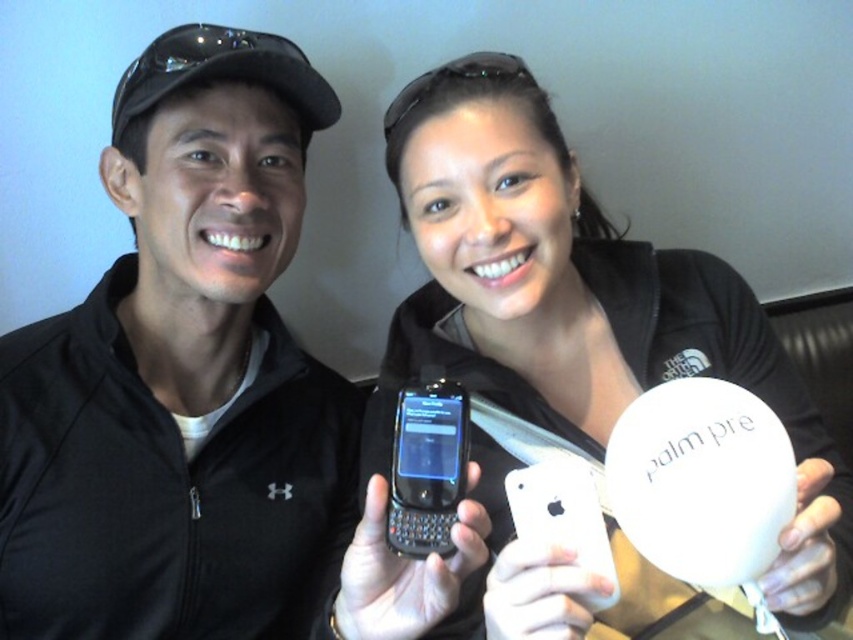
Is white matte palm pre case at center smaller than black plastic smartphone at center?

No, white matte palm pre case at center is not smaller than black plastic smartphone at center.

Which is below, white matte palm pre case at center or black plastic smartphone at center?

black plastic smartphone at center

Which is behind, point (567, 321) or point (398, 483)?

The point (567, 321) is more distant.

This screenshot has height=640, width=853. I want to click on white matte palm pre case at center, so [x=577, y=305].

Measure the distance from black matte phone at center to black plastic smartphone at center.

black matte phone at center and black plastic smartphone at center are 13.65 inches apart from each other.

Is black matte phone at center behind black plastic smartphone at center?

No.

Who is more distant from viewer, [128,573] or [413,424]?

The point [128,573] is behind.

You are a GUI agent. You are given a task and a screenshot of the screen. Output one action in this format:
    pyautogui.click(x=<x>, y=<y>)
    Task: Click on the black matte phone at center
    The image size is (853, 640).
    Given the screenshot: What is the action you would take?
    [x=200, y=394]

Between point (306, 141) and point (529, 356), which one is positioned behind?

Point (306, 141)

Looking at this image, does black matte phone at center have a greater height compared to white matte palm pre case at center?

Yes, black matte phone at center is taller than white matte palm pre case at center.

Is point (181, 112) positioned behind point (476, 232)?

Yes.

At what (x,y) coordinates should I click in order to perform the action: click on black matte phone at center. Please return your answer as a coordinate pair (x, y). Image resolution: width=853 pixels, height=640 pixels. Looking at the image, I should click on (200, 394).